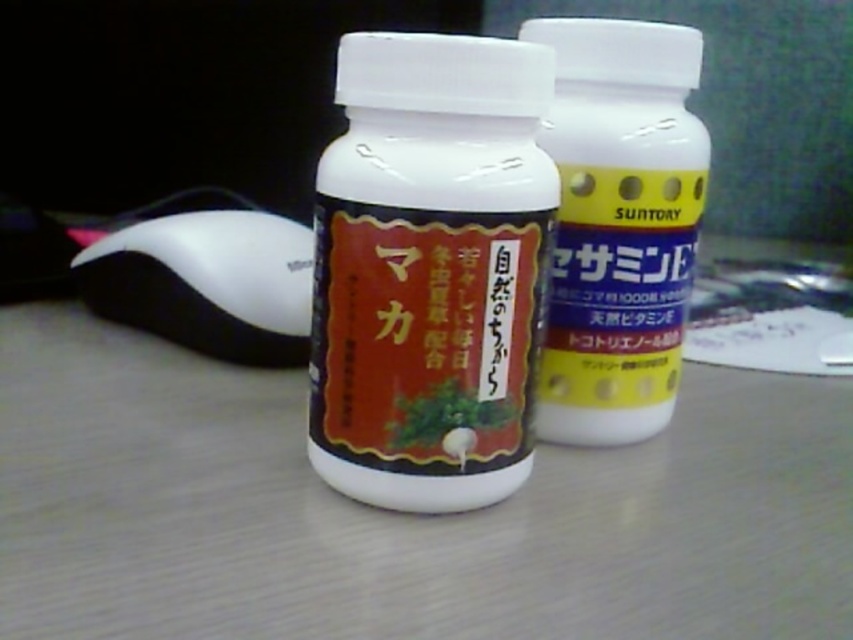
You are organizing a desk and need to place the white plastic table at center and the white plastic mouse at lower left. Based on their positions, which object is closer to you?

The white plastic table at center is closer to you because it is in front of the white plastic mouse at lower left.

You are holding a ruler and want to measure the distance between the white glossy bottle at center and the computer in the background. However, you can only measure up to 20 inches. Will your ruler be sufficient?

The white glossy bottle at center is 22.17 inches from viewer, so the ruler cannot measure the distance between the white glossy bottle at center and the computer in the background as it exceeds the ruler limit.

You are organizing items on a desk and need to place the white glossy bottle at center and the white plastic mouse at lower left. Which item should you pick up first if you want to place the smaller item closer to the edge of the desk?

The white glossy bottle at center is smaller than the white plastic mouse at lower left, so you should pick up the white glossy bottle at center first to place it closer to the edge of the desk.